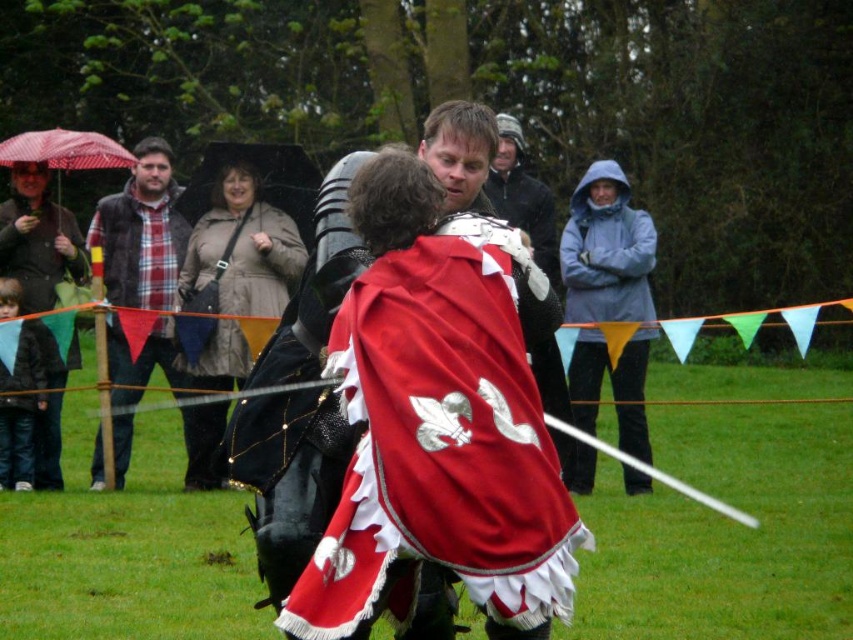
Question: Which object appears farthest from the camera in this image?

Choices:
 (A) plaid fabric shirt at left
 (B) red fabric umbrella at center
 (C) gray fleece jacket at upper center
 (D) beige textured coat at center

Answer: (B)

Question: Is beige textured coat at center to the right of plaid fabric shirt at left from the viewer's perspective?

Choices:
 (A) no
 (B) yes

Answer: (B)

Question: Which point is closer to the camera taking this photo?

Choices:
 (A) (584, 211)
 (B) (128, 160)
 (C) (32, 172)
 (D) (538, 429)

Answer: (D)

Question: Can you confirm if beige textured coat at center is positioned below gray fleece jacket at upper center?

Choices:
 (A) yes
 (B) no

Answer: (B)

Question: Which object is closer to the camera taking this photo?

Choices:
 (A) matte black jacket at left
 (B) plaid fabric shirt at left

Answer: (B)

Question: Is matte black jacket at left to the right of red fabric umbrella at center from the viewer's perspective?

Choices:
 (A) yes
 (B) no

Answer: (B)